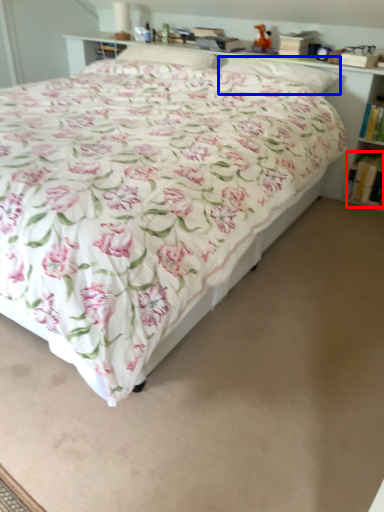
Question: Which object is further to the camera taking this photo, book (highlighted by a red box) or pillow (highlighted by a blue box)?

Choices:
 (A) book
 (B) pillow

Answer: (A)